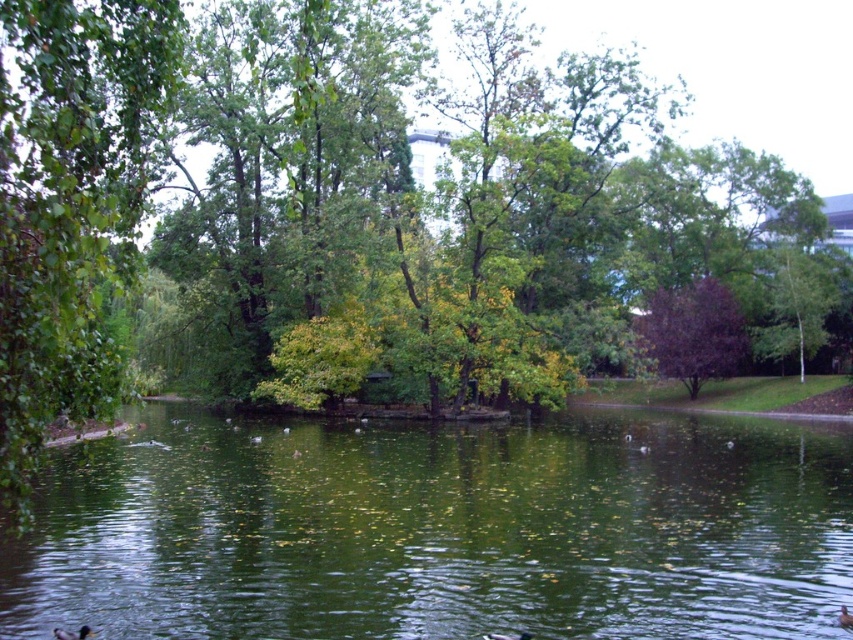
Question: Is brown fuzzy duck at lower left below brown matte duck at lower center?

Choices:
 (A) no
 (B) yes

Answer: (A)

Question: Is green reflective water at center positioned before purple glossy tree at center?

Choices:
 (A) no
 (B) yes

Answer: (B)

Question: Among these points, which one is nearest to the camera?

Choices:
 (A) (491, 637)
 (B) (845, 609)
 (C) (741, 609)

Answer: (A)

Question: Among these objects, which one is nearest to the camera?

Choices:
 (A) green reflective water at center
 (B) brown fuzzy duck at lower left

Answer: (B)

Question: Is the position of green reflective water at center less distant than that of brown fuzzy duck at lower left?

Choices:
 (A) yes
 (B) no

Answer: (B)

Question: Which of the following is the farthest from the observer?

Choices:
 (A) brown matte duck at lower center
 (B) purple glossy tree at center
 (C) brown fuzzy duck at center

Answer: (B)